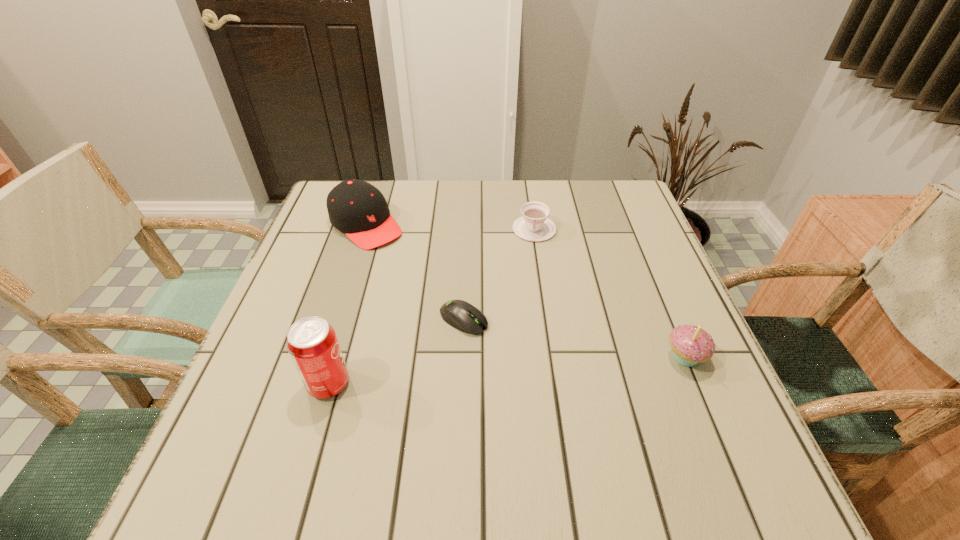
Where is `vacant space located on the handle side of the second object from right to left`? The image size is (960, 540). vacant space located on the handle side of the second object from right to left is located at coordinates [526, 349].

Locate an element on the screen. blank area located 0.300m on the handle side of the second object from right to left is located at coordinates (527, 330).

The width and height of the screenshot is (960, 540). I want to click on free space located 0.300m on the front-facing side of the cap, so click(x=456, y=310).

Where is `vacant space located on the front-facing side of the cap`? vacant space located on the front-facing side of the cap is located at coordinates (398, 256).

Locate an element on the screen. Image resolution: width=960 pixels, height=540 pixels. blank space located on the front-facing side of the cap is located at coordinates (402, 260).

What are the coordinates of `vacant space located 0.120m on the wheel side of the shortest object` in the screenshot? It's located at (530, 359).

The height and width of the screenshot is (540, 960). I want to click on free space located on the wheel side of the shortest object, so click(569, 383).

At what (x,y) coordinates should I click in order to perform the action: click on vacant space located on the wheel side of the shortest object. Please return your answer as a coordinate pair (x, y). The image size is (960, 540). Looking at the image, I should click on (506, 344).

The width and height of the screenshot is (960, 540). I want to click on teacup that is positioned at the far edge, so click(534, 226).

Identify the location of cap located in the far edge section of the desktop. The width and height of the screenshot is (960, 540). (355, 207).